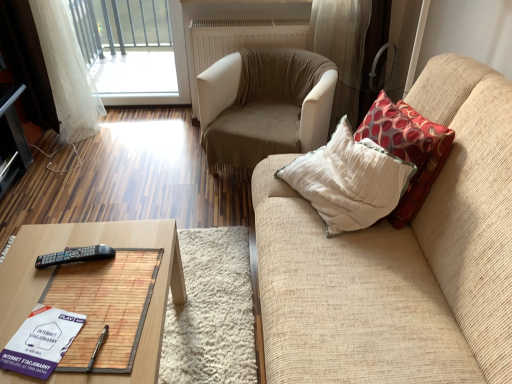
Question: From a real-world perspective, is transparent glass window at upper left positioned over beige fabric armchair at center based on gravity?

Choices:
 (A) yes
 (B) no

Answer: (A)

Question: Could you tell me if transparent glass window at upper left is facing beige fabric armchair at center?

Choices:
 (A) no
 (B) yes

Answer: (A)

Question: Is transparent glass window at upper left thinner than beige fabric armchair at center?

Choices:
 (A) no
 (B) yes

Answer: (B)

Question: Can you confirm if transparent glass window at upper left is smaller than beige fabric armchair at center?

Choices:
 (A) yes
 (B) no

Answer: (A)

Question: Is transparent glass window at upper left positioned beyond the bounds of beige fabric armchair at center?

Choices:
 (A) yes
 (B) no

Answer: (A)

Question: Considering the relative positions of transparent glass window at upper left and beige fabric armchair at center in the image provided, is transparent glass window at upper left to the right of beige fabric armchair at center from the viewer's perspective?

Choices:
 (A) yes
 (B) no

Answer: (B)

Question: Is black glossy tv stand at left facing away from red patterned fabric pillow at right?

Choices:
 (A) no
 (B) yes

Answer: (A)

Question: Considering the relative sizes of black glossy tv stand at left and red patterned fabric pillow at right in the image provided, is black glossy tv stand at left thinner than red patterned fabric pillow at right?

Choices:
 (A) no
 (B) yes

Answer: (A)

Question: Is black glossy tv stand at left outside of red patterned fabric pillow at right?

Choices:
 (A) yes
 (B) no

Answer: (A)

Question: Could you tell me if black glossy tv stand at left is facing red patterned fabric pillow at right?

Choices:
 (A) yes
 (B) no

Answer: (A)

Question: From the image's perspective, is black glossy tv stand at left located above red patterned fabric pillow at right?

Choices:
 (A) yes
 (B) no

Answer: (A)

Question: Considering the relative sizes of black glossy tv stand at left and red patterned fabric pillow at right in the image provided, is black glossy tv stand at left bigger than red patterned fabric pillow at right?

Choices:
 (A) no
 (B) yes

Answer: (B)

Question: Does transparent glass window at upper left have a smaller size compared to woodenwoodentable at lower left?

Choices:
 (A) no
 (B) yes

Answer: (B)